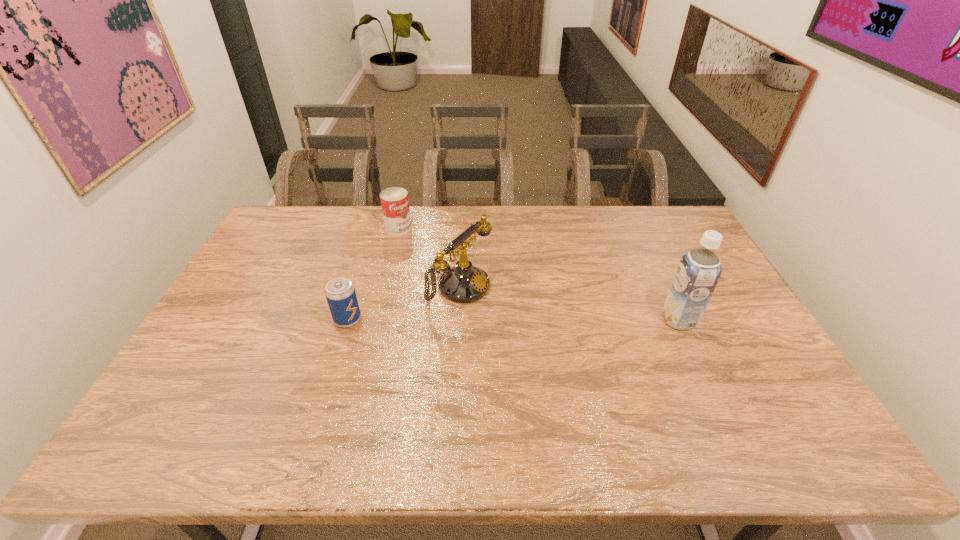
You are a GUI agent. You are given a task and a screenshot of the screen. Output one action in this format:
    pyautogui.click(x=<x>, y=<y>)
    Task: Click on the unoccupied area between the rightmost object and the can
    The image size is (960, 540).
    Given the screenshot: What is the action you would take?
    pyautogui.click(x=539, y=274)

Locate an element on the screen. The width and height of the screenshot is (960, 540). free area in between the third shortest object and the rightmost object is located at coordinates (568, 303).

Where is `empty space that is in between the second object from right to left and the can`? This screenshot has height=540, width=960. empty space that is in between the second object from right to left and the can is located at coordinates (428, 258).

Image resolution: width=960 pixels, height=540 pixels. I want to click on free space between the soya milk and the beer can, so click(x=514, y=320).

Where is `object that is the closest to the beer can`? This screenshot has width=960, height=540. object that is the closest to the beer can is located at coordinates (464, 283).

I want to click on object that is the third closest to the beer can, so click(699, 270).

Locate an element on the screen. Image resolution: width=960 pixels, height=540 pixels. vacant region that satisfies the following two spatial constraints: 1. on the front side of the beer can; 2. on the label of the tallest object is located at coordinates (348, 320).

I want to click on vacant space that satisfies the following two spatial constraints: 1. on the front side of the third shortest object; 2. on the label of the rightmost object, so click(x=456, y=320).

In order to click on vacant point that satisfies the following two spatial constraints: 1. on the front side of the beer can; 2. on the label of the rightmost object in this screenshot , I will do tap(348, 320).

Image resolution: width=960 pixels, height=540 pixels. In order to click on vacant space that satisfies the following two spatial constraints: 1. on the back side of the beer can; 2. on the left side of the farthest object in this screenshot , I will do point(376,228).